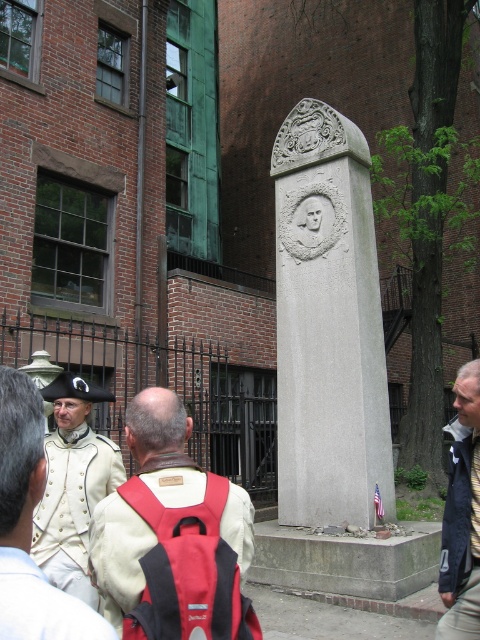
Is gray stone monument at center in front of red backpack at center?

That is False.

Is gray stone monument at center above red backpack at center?

Correct, gray stone monument at center is located above red backpack at center.

Image resolution: width=480 pixels, height=640 pixels. What do you see at coordinates (327, 324) in the screenshot?
I see `gray stone monument at center` at bounding box center [327, 324].

Identify the location of gray stone monument at center. The image size is (480, 640). (327, 324).

Between red backpack at center and white matte uniform at center, which one has less height?

Standing shorter between the two is red backpack at center.

Does red backpack at center appear under white matte uniform at center?

Incorrect, red backpack at center is not positioned below white matte uniform at center.

Locate an element on the screen. This screenshot has width=480, height=640. red backpack at center is located at coordinates (172, 536).

Find the location of a particular element. The width and height of the screenshot is (480, 640). red backpack at center is located at coordinates (172, 536).

You are a GUI agent. You are given a task and a screenshot of the screen. Output one action in this format:
    pyautogui.click(x=<x>, y=<y>)
    Task: Click on the gray stone monument at center
    This screenshot has height=640, width=480.
    Given the screenshot: What is the action you would take?
    pyautogui.click(x=327, y=324)

Does point (324, 120) come in front of point (54, 500)?

No, it is behind (54, 500).

Find the location of a particular element. The width and height of the screenshot is (480, 640). gray stone monument at center is located at coordinates (327, 324).

The width and height of the screenshot is (480, 640). I want to click on gray stone monument at center, so click(x=327, y=324).